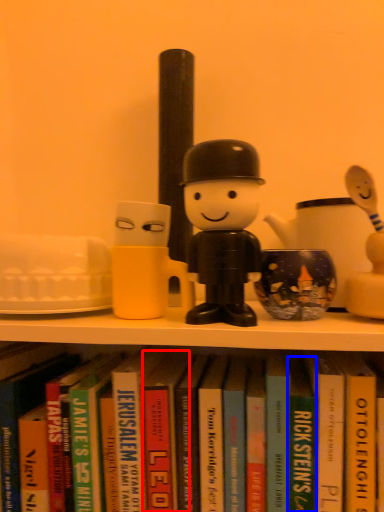
Question: Which object appears farthest to the camera in this image, paperback book (highlighted by a red box) or paperback book (highlighted by a blue box)?

Choices:
 (A) paperback book
 (B) paperback book

Answer: (A)